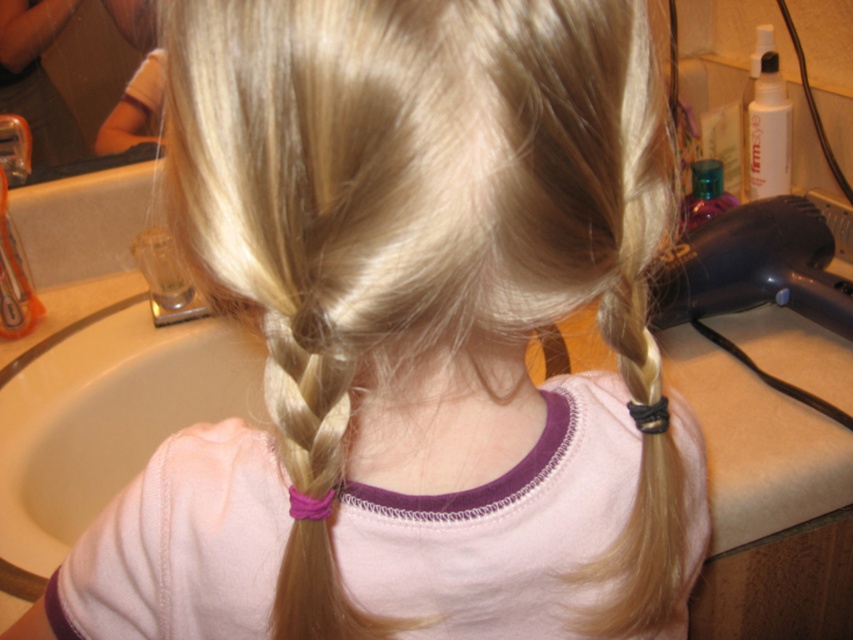
Between black plastic hair dryer at right and brushed metal faucet at upper left, which one appears on the right side from the viewer's perspective?

Positioned to the right is black plastic hair dryer at right.

Between point (744, 224) and point (19, 140), which one is positioned behind?

The point (19, 140) is more distant.

Image resolution: width=853 pixels, height=640 pixels. Describe the element at coordinates (753, 266) in the screenshot. I see `black plastic hair dryer at right` at that location.

This screenshot has height=640, width=853. I want to click on black plastic hair dryer at right, so click(753, 266).